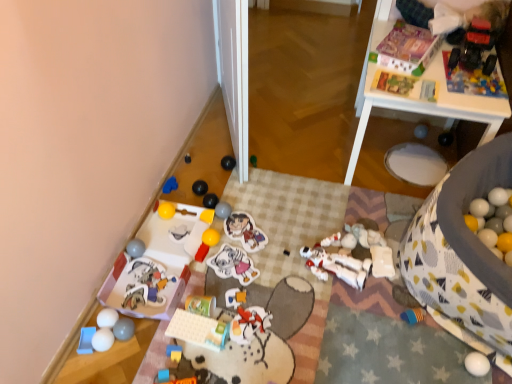
Locate an element on the screen. free space that is in between rubber yellow block at lower center, marked as the eleventh toy in a left-to-right arrangement, and white matte doll at center, acting as the 22th toy starting from the left is located at coordinates (274, 301).